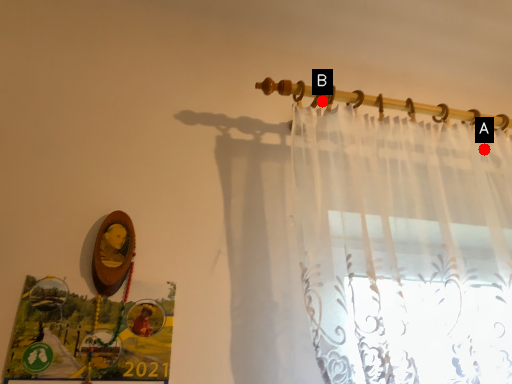
Question: Two points are circled on the image, labeled by A and B beside each circle. Which of the following is the farthest from the observer?

Choices:
 (A) A is further
 (B) B is further

Answer: (A)